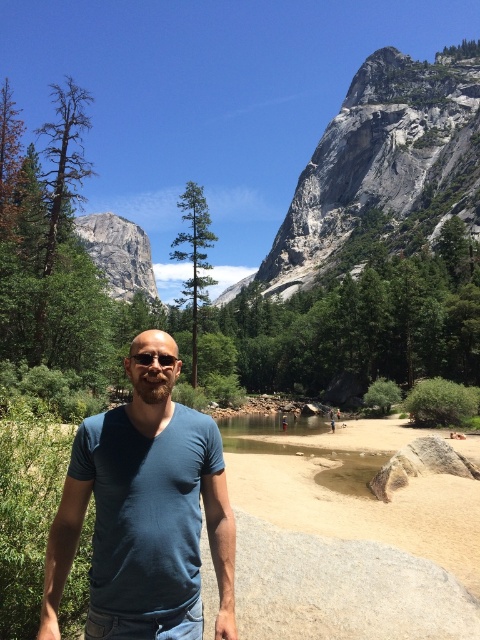
You are a photographer trying to capture a closeup shot of the blue cotton shirt at center and the clear plastic goggles at center. Which object should you focus on first to ensure both are in focus?

The blue cotton shirt at center is closer to the viewer than the clear plastic goggles at center, so you should focus on the blue cotton shirt at center first to ensure both are in focus.